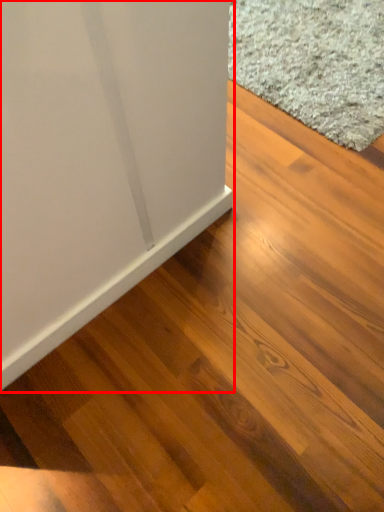
Question: In this image, where is furniture (annotated by the red box) located relative to doormat?

Choices:
 (A) right
 (B) left

Answer: (B)